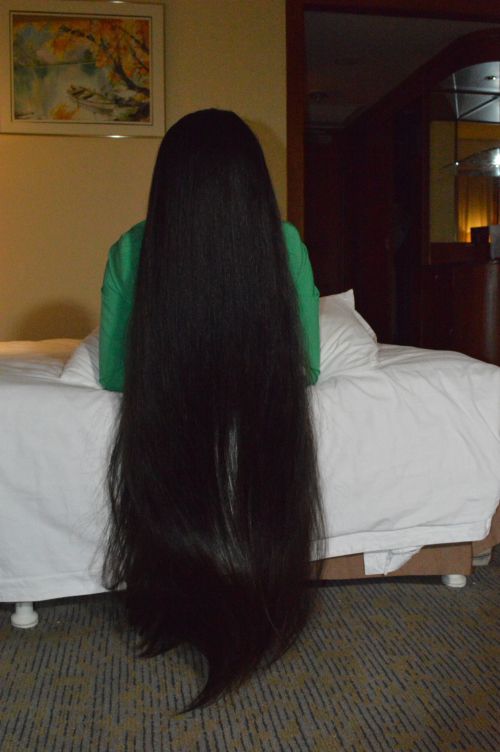
Identify the location of ceiling. (394, 53).